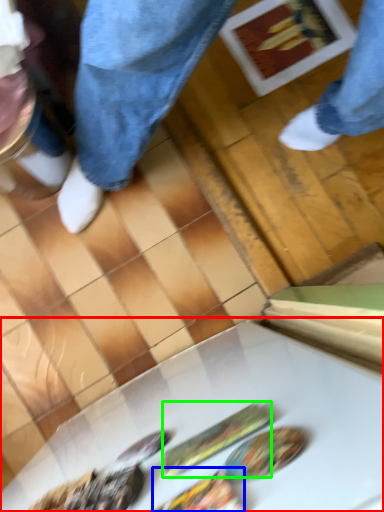
Question: Estimate the real-world distances between objects in this image. Which object is closer to table (highlighted by a red box), food (highlighted by a blue box) or food (highlighted by a green box)?

Choices:
 (A) food
 (B) food

Answer: (B)